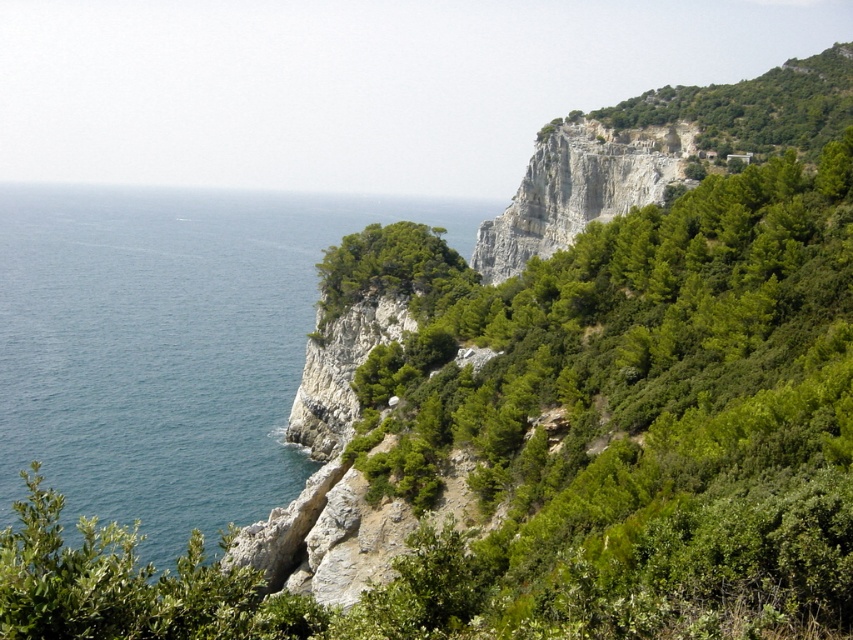
You are a hiker who wants to take a photo of the blue water at left while also including the green leafy shrub at upper right in the frame. Given their sizes, will you need to zoom out to capture both in the same photo?

The green leafy shrub at upper right has a smaller size compared to blue water at left. To include both in the same photo, you would need to zoom out to ensure the smaller shrub and the larger water area are both visible in the frame.